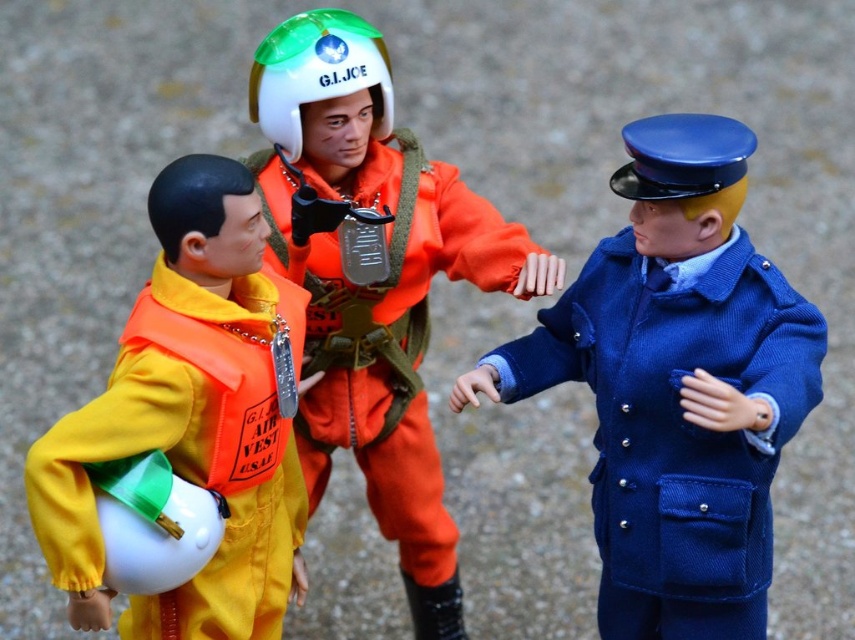
Based on the photo, between orange fabric life vest at left and white matte helmet at center, which one appears on the right side from the viewer's perspective?

Positioned to the right is white matte helmet at center.

What do you see at coordinates (192, 419) in the screenshot?
I see `orange fabric life vest at left` at bounding box center [192, 419].

Image resolution: width=855 pixels, height=640 pixels. I want to click on orange fabric life vest at left, so click(192, 419).

Is orange matte jumpsuit at center wider than blue matte helmet at upper right?

Indeed, orange matte jumpsuit at center has a greater width compared to blue matte helmet at upper right.

Does orange matte jumpsuit at center lie behind blue matte helmet at upper right?

Yes, orange matte jumpsuit at center is behind blue matte helmet at upper right.

Is point (387, 72) more distant than point (696, 179)?

Yes.

Where is `orange matte jumpsuit at center`? The height and width of the screenshot is (640, 855). orange matte jumpsuit at center is located at coordinates [x=375, y=280].

Looking at this image, is blue woolen coat at center to the left of white matte helmet at center from the viewer's perspective?

In fact, blue woolen coat at center is to the right of white matte helmet at center.

Is point (647, 372) positioned in front of point (388, 58)?

That is True.

The height and width of the screenshot is (640, 855). Identify the location of blue woolen coat at center. (676, 385).